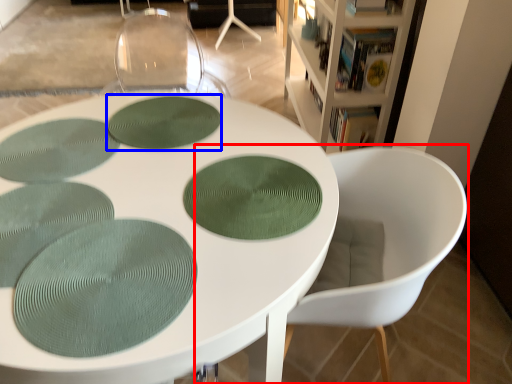
Question: Which object appears farthest to the camera in this image, chair (highlighted by a red box) or oval (highlighted by a blue box)?

Choices:
 (A) chair
 (B) oval

Answer: (B)